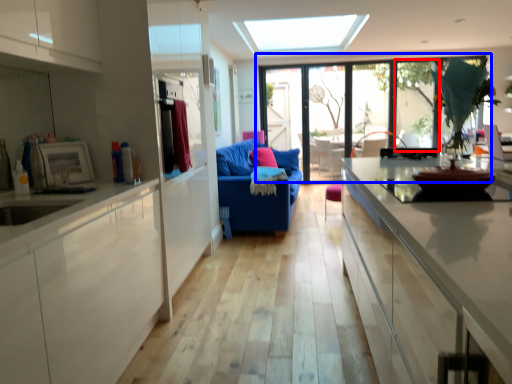
Question: Which of the following is the farthest to the observer, window (highlighted by a red box) or window (highlighted by a blue box)?

Choices:
 (A) window
 (B) window

Answer: (A)